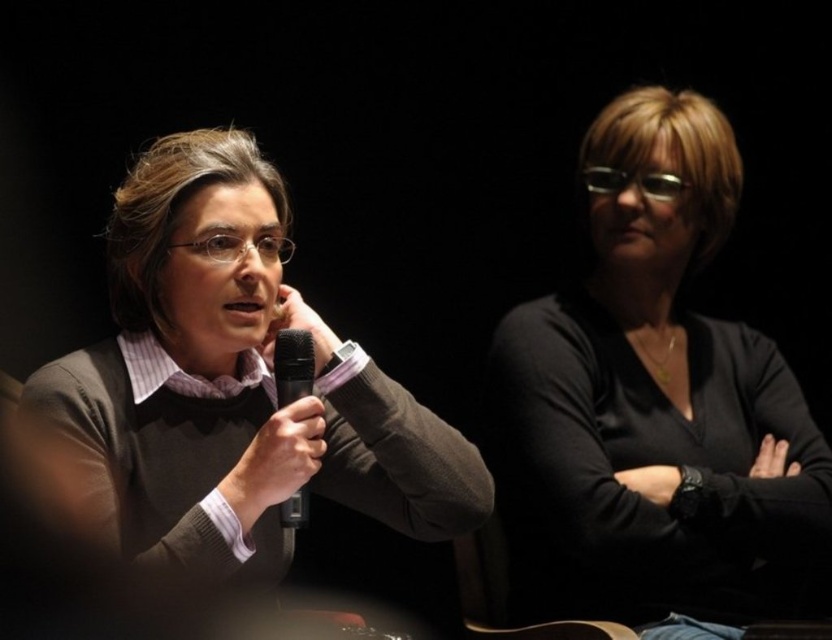
Question: Which is farther from the matte gray sweater at left?

Choices:
 (A) black matte microphone at center
 (B) black matte shirt at upper right

Answer: (B)

Question: Does black matte shirt at upper right have a larger size compared to black matte microphone at center?

Choices:
 (A) yes
 (B) no

Answer: (A)

Question: Which object is the farthest from the black matte microphone at center?

Choices:
 (A) black matte shirt at upper right
 (B) matte gray sweater at left

Answer: (A)

Question: Which point is closer to the camera?

Choices:
 (A) (677, 592)
 (B) (441, 445)
 (C) (291, 502)

Answer: (C)

Question: Is matte gray sweater at left to the left of black matte microphone at center from the viewer's perspective?

Choices:
 (A) no
 (B) yes

Answer: (B)

Question: Is black matte shirt at upper right bigger than matte gray sweater at left?

Choices:
 (A) no
 (B) yes

Answer: (B)